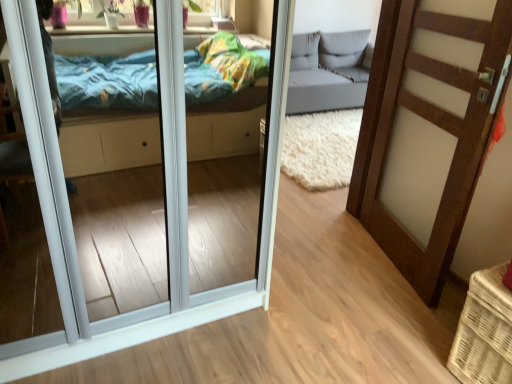
Question: Does white wicker basket at lower right appear on the left side of brown wood door at right, which is the 2th door from left to right?

Choices:
 (A) no
 (B) yes

Answer: (A)

Question: Is white wicker basket at lower right shorter than brown wood door at right, which is the 2th door from left to right?

Choices:
 (A) yes
 (B) no

Answer: (A)

Question: Considering the relative sizes of white wicker basket at lower right and brown wood door at right, which is the 2th door from left to right, in the image provided, is white wicker basket at lower right wider than brown wood door at right, which is the 2th door from left to right,?

Choices:
 (A) no
 (B) yes

Answer: (B)

Question: Could you tell me if white wicker basket at lower right is turned towards brown wood door at right, which is the 2th door from left to right?

Choices:
 (A) no
 (B) yes

Answer: (A)

Question: Does white wicker basket at lower right come behind brown wood door at right, which is the 2th door from left to right?

Choices:
 (A) no
 (B) yes

Answer: (A)

Question: Are white wicker basket at lower right and brown wood door at right, placed as the 1th door when sorted from right to left, far apart?

Choices:
 (A) no
 (B) yes

Answer: (A)

Question: Is white glossy door at center, positioned as the 1th door in left-to-right order, turned away from white wicker basket at lower right?

Choices:
 (A) no
 (B) yes

Answer: (A)

Question: Is white glossy door at center, acting as the 2th door starting from the right, to the right of white wicker basket at lower right from the viewer's perspective?

Choices:
 (A) yes
 (B) no

Answer: (B)

Question: Does white glossy door at center, positioned as the 1th door in left-to-right order, lie behind white wicker basket at lower right?

Choices:
 (A) no
 (B) yes

Answer: (A)

Question: From a real-world perspective, is white glossy door at center, positioned as the 1th door in left-to-right order, positioned over white wicker basket at lower right based on gravity?

Choices:
 (A) yes
 (B) no

Answer: (A)

Question: Does white glossy door at center, positioned as the 1th door in left-to-right order, have a lesser height compared to white wicker basket at lower right?

Choices:
 (A) no
 (B) yes

Answer: (A)

Question: Is white wicker basket at lower right surrounded by white glossy door at center, acting as the 2th door starting from the right?

Choices:
 (A) no
 (B) yes

Answer: (A)

Question: Is white glossy door at center, acting as the 2th door starting from the right, to the right of brown wood door at right, which is the 2th door from left to right, from the viewer's perspective?

Choices:
 (A) yes
 (B) no

Answer: (B)